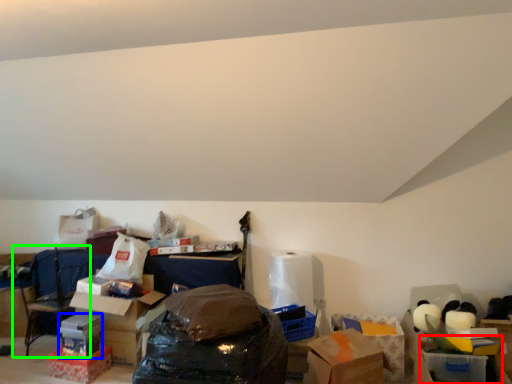
Question: Which is nearer to the storage box (highlighted by a red box)? storage box (highlighted by a blue box) or armchair (highlighted by a green box).

Choices:
 (A) storage box
 (B) armchair

Answer: (A)